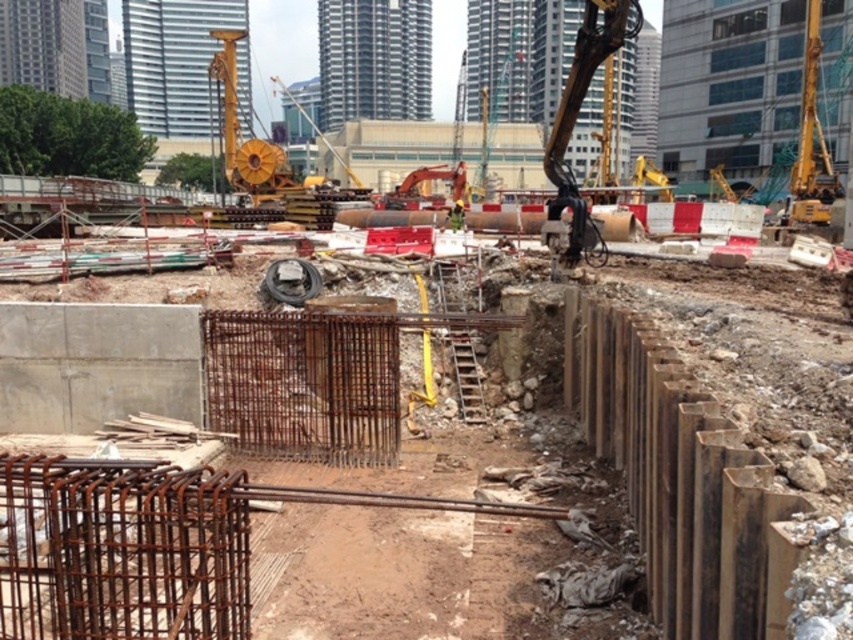
Is rusty metal rebar at center to the right of metallic yellow construction worker at center from the viewer's perspective?

In fact, rusty metal rebar at center is to the left of metallic yellow construction worker at center.

Is point (132, 484) closer to camera compared to point (463, 204)?

Yes, point (132, 484) is in front of point (463, 204).

Locate an element on the screen. rusty metal rebar at center is located at coordinates (144, 545).

Between metallic arm at upper right and metallic yellow construction worker at center, which one is positioned higher?

metallic arm at upper right

Between metallic arm at upper right and metallic yellow construction worker at center, which one appears on the right side from the viewer's perspective?

Positioned to the right is metallic arm at upper right.

Find the location of a particular element. The image size is (853, 640). metallic arm at upper right is located at coordinates (573, 125).

Is rusty metal rebar at center taller than metallic arm at upper right?

No.

Can you confirm if rusty metal rebar at center is positioned to the left of metallic arm at upper right?

Yes, rusty metal rebar at center is to the left of metallic arm at upper right.

Is point (634, 492) positioned behind point (563, 262)?

That is False.

The width and height of the screenshot is (853, 640). I want to click on rusty metal rebar at center, so pos(144,545).